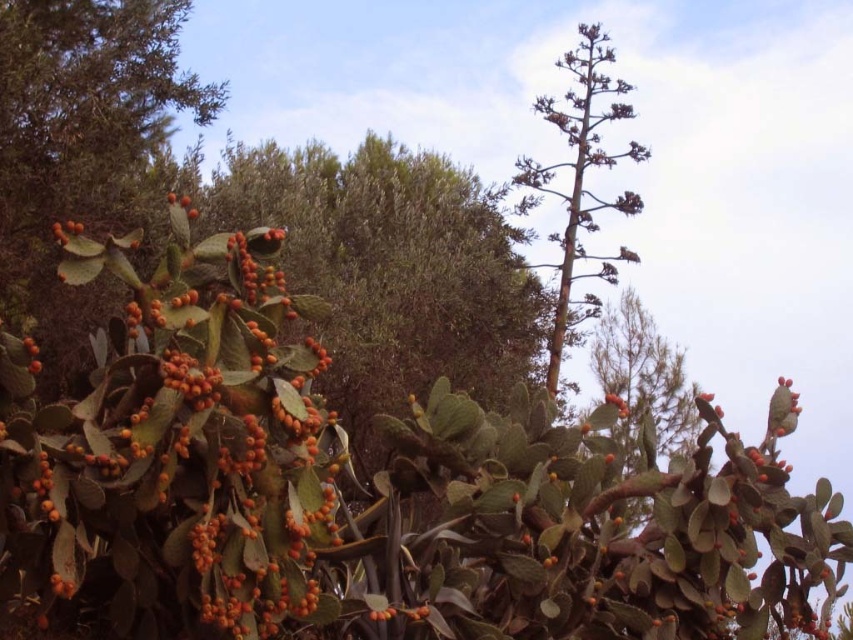
Question: Which object is closer to the camera taking this photo?

Choices:
 (A) orange matte cactus fruit at left
 (B) orange matte fruit at lower left
 (C) orange matte cactus fruit at center-left

Answer: (C)

Question: Is orange matte cactus at left in front of orange matte cactus fruit at center-right?

Choices:
 (A) no
 (B) yes

Answer: (B)

Question: Where is green leafy tree at upper right located in relation to orange matte cactus fruit at center-left in the image?

Choices:
 (A) left
 (B) right

Answer: (B)

Question: Which point is farther to the camera?

Choices:
 (A) (70, 224)
 (B) (581, 124)
 (C) (616, 397)
 (D) (376, 620)

Answer: (B)

Question: Which point is farther from the camera taking this photo?

Choices:
 (A) (576, 106)
 (B) (71, 241)

Answer: (A)

Question: Is orange matte cactus fruit at center-left wider than orange matte cactus fruit at left?

Choices:
 (A) no
 (B) yes

Answer: (A)